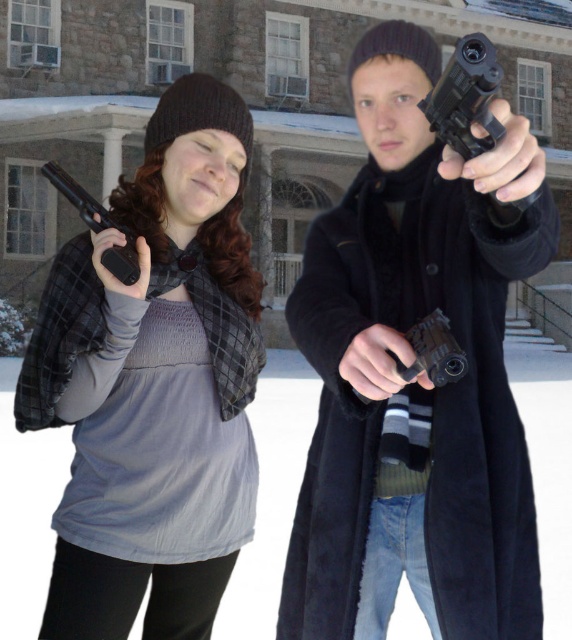
Does black plastic handgun at center come behind matte black handgun at left?

That is False.

Does black plastic handgun at center have a smaller size compared to matte black handgun at left?

Yes.

Which is in front, point (494, 212) or point (96, 209)?

Point (494, 212) is in front.

Locate an element on the screen. This screenshot has width=572, height=640. black plastic handgun at center is located at coordinates (466, 97).

Which of these two, matte black gun at left or matte black handgun at left, stands shorter?

With less height is matte black handgun at left.

Who is lower down, matte black gun at left or matte black handgun at left?

matte black gun at left is lower down.

This screenshot has width=572, height=640. What do you see at coordinates (154, 385) in the screenshot? I see `matte black gun at left` at bounding box center [154, 385].

This screenshot has width=572, height=640. In order to click on matte black gun at left in this screenshot , I will do `click(154, 385)`.

In the scene shown: Which is above, matte black gun at left or black plastic handgun at center?

black plastic handgun at center is higher up.

Is matte black gun at left below black plastic handgun at center?

Yes, matte black gun at left is below black plastic handgun at center.

Who is more forward, (201, 618) or (447, 138)?

Point (447, 138)

You are a GUI agent. You are given a task and a screenshot of the screen. Output one action in this format:
    pyautogui.click(x=<x>, y=<y>)
    Task: Click on the matte black gun at left
    The width and height of the screenshot is (572, 640).
    Given the screenshot: What is the action you would take?
    pyautogui.click(x=154, y=385)